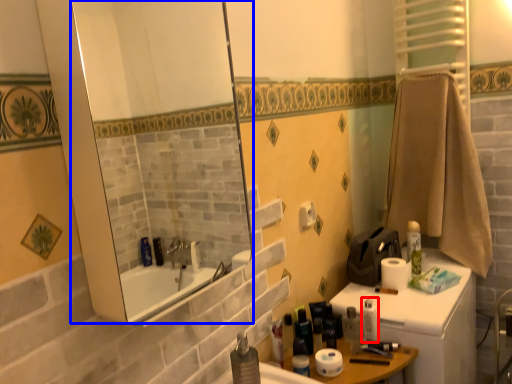
Question: Which point is closer to the camera, toiletry (highlighted by a red box) or mirror (highlighted by a blue box)?

Choices:
 (A) toiletry
 (B) mirror

Answer: (B)